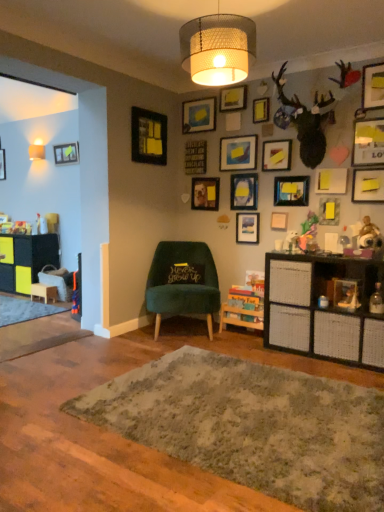
Question: From a real-world perspective, is matte black picture frame at upper right, which is the first picture frame from right to left, above or below yellow matte picture frame at upper right, which ranks as the 10th picture frame in left-to-right order?

Choices:
 (A) below
 (B) above

Answer: (B)

Question: Is matte black picture frame at upper right, which is the first picture frame from right to left, spatially inside yellow matte picture frame at upper right, which is the eighth picture frame in right-to-left order, or outside of it?

Choices:
 (A) outside
 (B) inside

Answer: (A)

Question: Which of these objects is positioned closest to the velvet green chair at center?

Choices:
 (A) yellow matte picture frame at upper center, which is the ninth picture frame from left to right
 (B) yellow matte picture frame at upper right, the sixteenth picture frame positioned from the left
 (C) yellow matte picture frame at upper right, marked as the 13th picture frame in a left-to-right arrangement
 (D) black plastic shelf at right
 (E) matte yellow picture frame at upper center, which is counted as the 3th picture frame, starting from the left

Answer: (D)

Question: Considering the real-world distances, which object is closest to the matte black picture frame at upper right, the 6th picture frame when ordered from right to left?

Choices:
 (A) matte black picture frame at upper left, the seventeenth picture frame when ordered from right to left
 (B) yellow matte picture frame at upper center, which is the ninth picture frame from left to right
 (C) black plastic shelf at right
 (D) matte white lampshade at upper left, which ranks as the first lamp in left-to-right order
 (E) yellow matte picture frame at upper right, marked as the 13th picture frame in a left-to-right arrangement

Answer: (E)